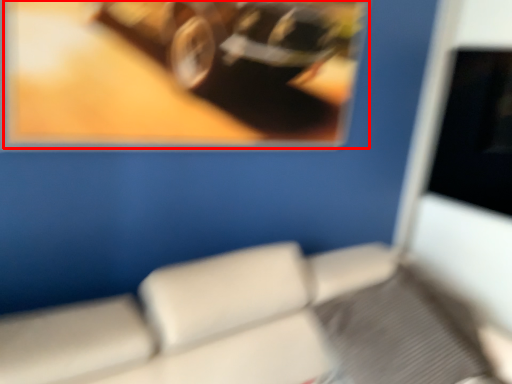
Question: Where is picture frame (annotated by the red box) located in relation to furniture in the image?

Choices:
 (A) right
 (B) left

Answer: (B)